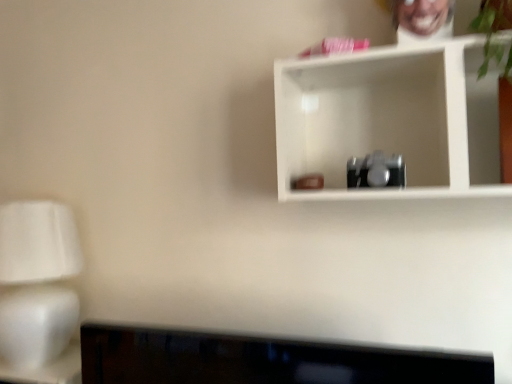
Measure the distance between point (470, 70) and camera.

Point (470, 70) and camera are 1.11 meters apart.

Locate an element on the screen. white matte shelf at upper center is located at coordinates (390, 120).

Consider the image. Measure the distance between white matte shelf at upper center and camera.

white matte shelf at upper center is 35.58 inches away from camera.

What do you see at coordinates (390, 120) in the screenshot? The width and height of the screenshot is (512, 384). I see `white matte shelf at upper center` at bounding box center [390, 120].

You are a GUI agent. You are given a task and a screenshot of the screen. Output one action in this format:
    pyautogui.click(x=<x>, y=<y>)
    Task: Click on the white matte table lamp at left
    
    Given the screenshot: What is the action you would take?
    pyautogui.click(x=37, y=281)

The height and width of the screenshot is (384, 512). Describe the element at coordinates (37, 281) in the screenshot. I see `white matte table lamp at left` at that location.

This screenshot has height=384, width=512. I want to click on white matte shelf at upper center, so click(x=390, y=120).

Based on the photo, is white matte shelf at upper center to the right of white matte table lamp at left from the viewer's perspective?

Correct, you'll find white matte shelf at upper center to the right of white matte table lamp at left.

Is white matte shelf at upper center closer to the viewer compared to white matte table lamp at left?

Yes, it is.

Which is closer, (342, 102) or (22, 272)?

Point (342, 102) appears to be closer to the viewer than point (22, 272).

From the image's perspective, is white matte shelf at upper center under white matte table lamp at left?

Incorrect, from the image's perspective, white matte shelf at upper center is higher than white matte table lamp at left.

From a real-world perspective, is white matte shelf at upper center above or below white matte table lamp at left?

Clearly, from a real-world perspective, white matte shelf at upper center is above white matte table lamp at left.

Is white matte shelf at upper center wider or thinner than white matte table lamp at left?

In the image, white matte shelf at upper center appears to be more narrow than white matte table lamp at left.

Does white matte shelf at upper center have a lesser height compared to white matte table lamp at left?

Correct, white matte shelf at upper center is not as tall as white matte table lamp at left.

Which of these two, white matte shelf at upper center or white matte table lamp at left, is smaller?

white matte shelf at upper center is smaller.

Would you say white matte shelf at upper center is inside or outside white matte table lamp at left?

white matte shelf at upper center cannot be found inside white matte table lamp at left.

Is white matte shelf at upper center next to white matte table lamp at left?

They are not placed beside each other.

Could you tell me if white matte shelf at upper center is facing white matte table lamp at left?

No, white matte shelf at upper center is not turned towards white matte table lamp at left.

The image size is (512, 384). I want to click on shelf that appears above the white matte table lamp at left (from the image's perspective), so click(390, 120).

Does white matte table lamp at left appear on the left side of white matte shelf at upper center?

Yes, white matte table lamp at left is to the left of white matte shelf at upper center.

Which is behind, white matte table lamp at left or white matte shelf at upper center?

white matte table lamp at left is behind.

Which is closer, (64, 320) or (443, 76)?

Positioned in front is point (443, 76).

From the image's perspective, would you say white matte table lamp at left is shown under white matte shelf at upper center?

Answer: Yes, from the image's perspective, white matte table lamp at left is below white matte shelf at upper center.

From a real-world perspective, does white matte table lamp at left stand above white matte shelf at upper center?

No, from a real-world perspective, white matte table lamp at left is not above white matte shelf at upper center.

Between white matte table lamp at left and white matte shelf at upper center, which one has larger width?

white matte table lamp at left is wider.

Considering the sizes of objects white matte table lamp at left and white matte shelf at upper center in the image provided, who is taller, white matte table lamp at left or white matte shelf at upper center?

white matte table lamp at left.

Considering the sizes of objects white matte table lamp at left and white matte shelf at upper center in the image provided, who is bigger, white matte table lamp at left or white matte shelf at upper center?

With larger size is white matte table lamp at left.

Which is correct: white matte table lamp at left is inside white matte shelf at upper center, or outside of it?

white matte table lamp at left is spatially situated outside white matte shelf at upper center.

Are white matte table lamp at left and white matte shelf at upper center far apart?

No, white matte table lamp at left is not far away from white matte shelf at upper center.

Is white matte table lamp at left facing towards white matte shelf at upper center?

No, white matte table lamp at left does not turn towards white matte shelf at upper center.

Where is `table lamp behind the white matte shelf at upper center`? This screenshot has width=512, height=384. table lamp behind the white matte shelf at upper center is located at coordinates (37, 281).

The width and height of the screenshot is (512, 384). Find the location of `shelf above the white matte table lamp at left (from a real-world perspective)`. shelf above the white matte table lamp at left (from a real-world perspective) is located at coordinates (390, 120).

Find the location of a particular element. Image resolution: width=512 pixels, height=384 pixels. shelf on the right of white matte table lamp at left is located at coordinates 390,120.